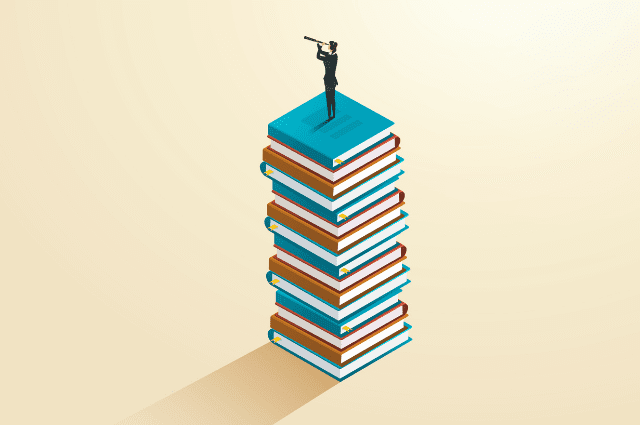
At what (x,y) coordinates should I click in order to perform the action: click on blue book. Please return your answer as a coordinate pair (x, y). The image size is (640, 425). Looking at the image, I should click on (320, 150), (329, 215), (392, 170), (333, 258), (333, 271), (336, 314), (335, 326), (326, 371).